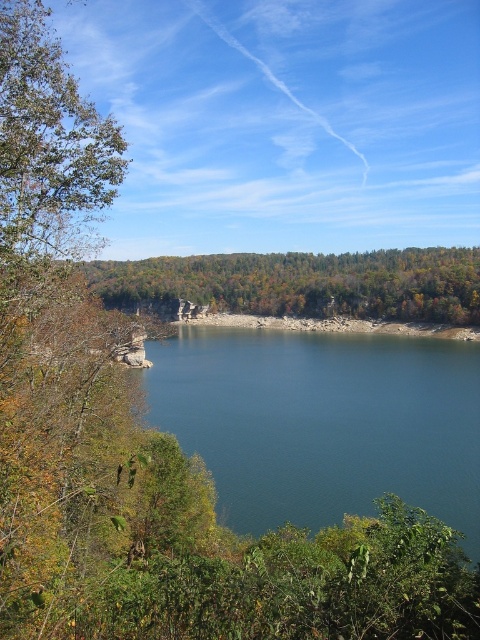
Who is positioned more to the left, deep blue water at center or green leafy trees at center?

From the viewer's perspective, deep blue water at center appears more on the left side.

Which of these two, deep blue water at center or green leafy trees at center, stands shorter?

With less height is deep blue water at center.

Image resolution: width=480 pixels, height=640 pixels. What do you see at coordinates (323, 422) in the screenshot?
I see `deep blue water at center` at bounding box center [323, 422].

Find the location of a particular element. The height and width of the screenshot is (640, 480). deep blue water at center is located at coordinates (323, 422).